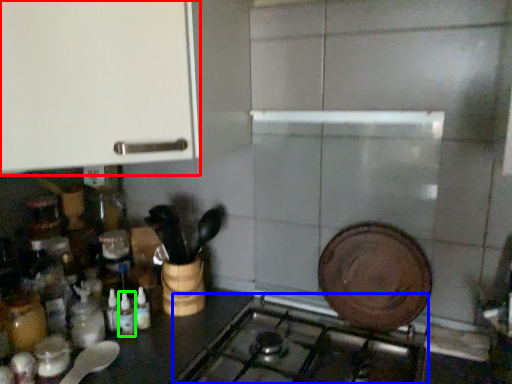
Question: Considering the real-world distances, which object is farthest from cabinetry (highlighted by a red box)? gas stove (highlighted by a blue box) or bottle (highlighted by a green box)?

Choices:
 (A) gas stove
 (B) bottle

Answer: (A)